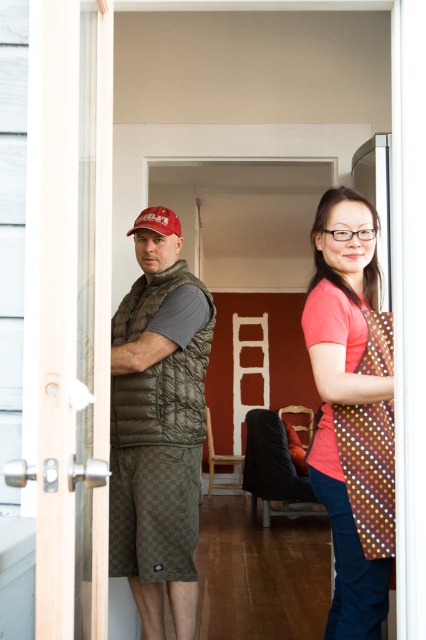
Question: Estimate the real-world distances between objects in this image. Which object is closer to the polka dot apron at right?

Choices:
 (A) quilted olive vest at center
 (B) matte red baseball cap at left

Answer: (A)

Question: Is quilted brown vest at center below matte red baseball cap at left?

Choices:
 (A) yes
 (B) no

Answer: (A)

Question: Which object appears closest to the camera in this image?

Choices:
 (A) quilted brown vest at center
 (B) matte red baseball cap at left
 (C) brown dotted fabric apron at right
 (D) polka dot apron at right

Answer: (D)

Question: Can you confirm if quilted olive vest at center is positioned above polka dot apron at right?

Choices:
 (A) yes
 (B) no

Answer: (B)

Question: Does brown dotted fabric apron at right have a greater width compared to matte red baseball cap at left?

Choices:
 (A) no
 (B) yes

Answer: (A)

Question: Which object appears farthest from the camera in this image?

Choices:
 (A) quilted olive vest at center
 (B) matte red baseball cap at left
 (C) brown dotted fabric apron at right
 (D) polka dot apron at right

Answer: (B)